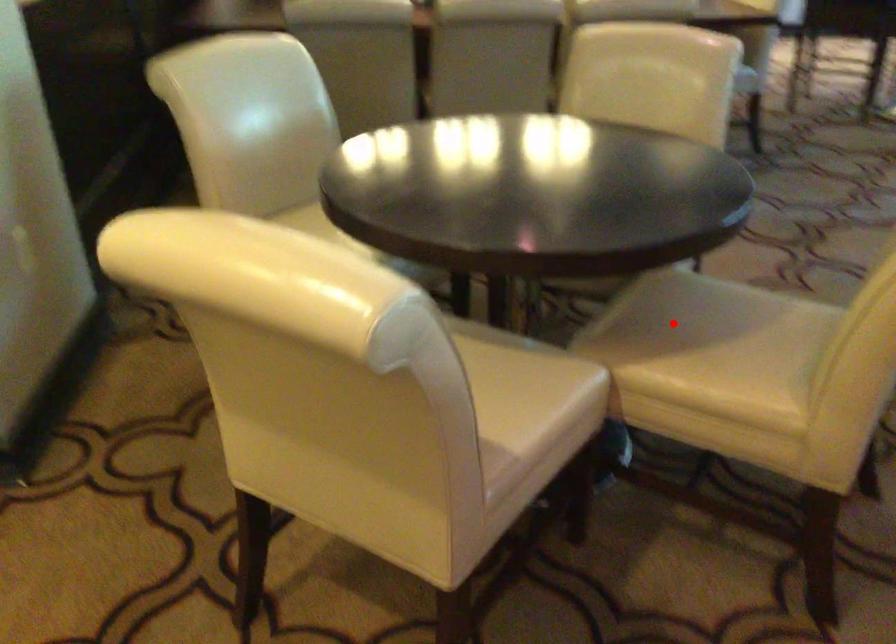
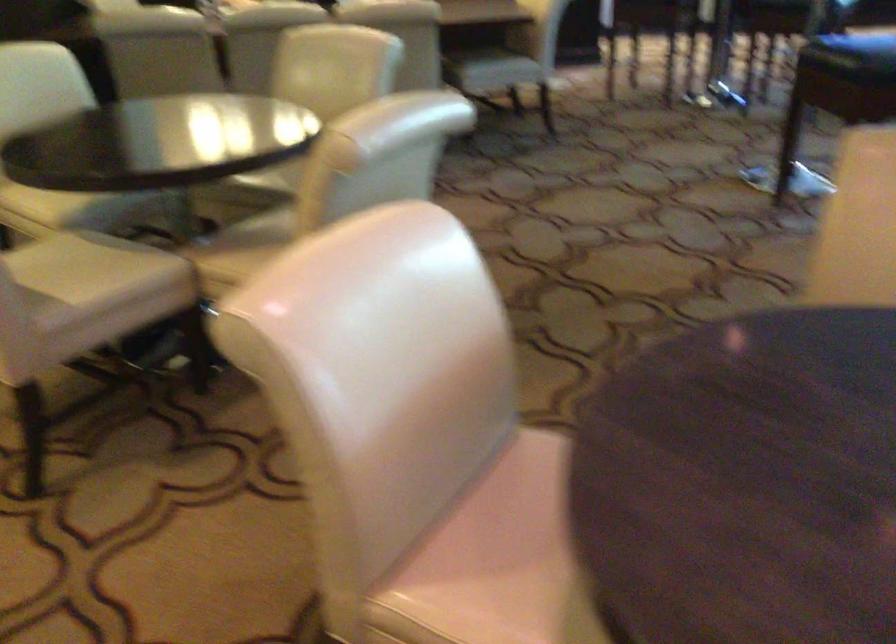
Question: I am providing you with two images of the same scene from different viewpoints. A red point is shown in image1. For the corresponding object point in image2, is it positioned nearer or farther from the camera?

Choices:
 (A) Nearer
 (B) Farther

Answer: (B)